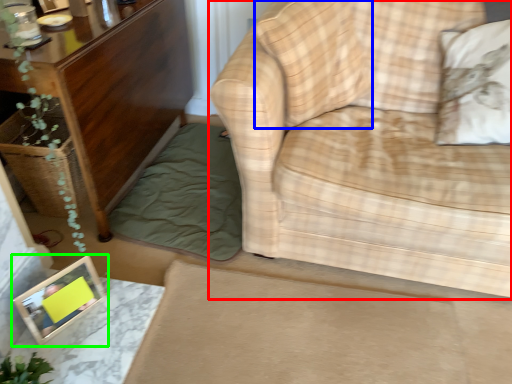
Question: Based on their relative distances, which object is farther from studio couch (highlighted by a red box)? Choose from pillow (highlighted by a blue box) and picture frame (highlighted by a green box).

Choices:
 (A) pillow
 (B) picture frame

Answer: (B)